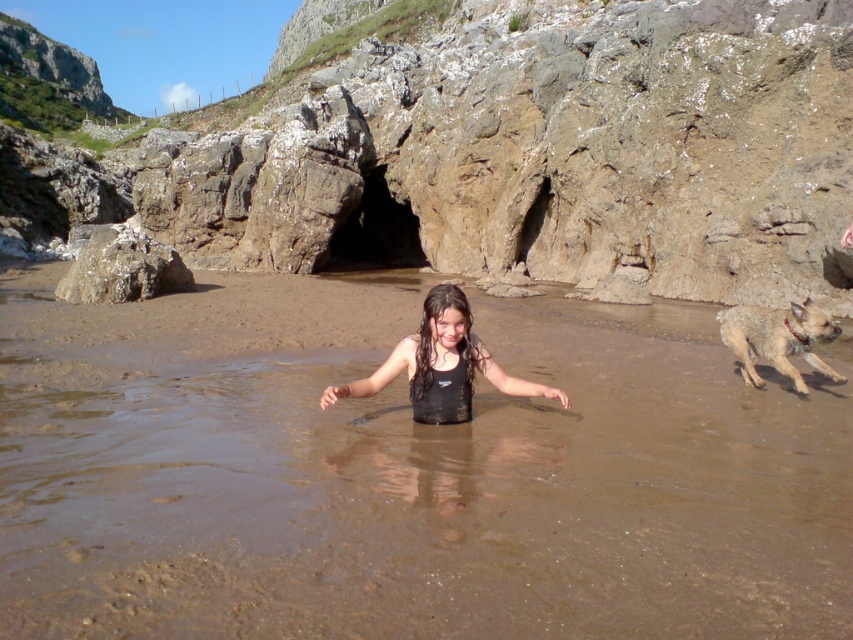
Question: Does smooth gray rock at center have a smaller size compared to brown furry dog at right?

Choices:
 (A) no
 (B) yes

Answer: (A)

Question: Is brown wet sand at center positioned before smooth gray rock at center?

Choices:
 (A) no
 (B) yes

Answer: (B)

Question: Is brown wet sand at center to the left of smooth gray rock at center from the viewer's perspective?

Choices:
 (A) yes
 (B) no

Answer: (B)

Question: Considering the real-world distances, which object is closest to the brown furry dog at right?

Choices:
 (A) brown wet sand at center
 (B) black matte swimsuit at center

Answer: (B)

Question: Which of the following is the farthest from the observer?

Choices:
 (A) smooth gray rock at center
 (B) black matte swimsuit at center
 (C) brown wet sand at center

Answer: (A)

Question: Among these points, which one is farthest from the camera?

Choices:
 (A) (741, 330)
 (B) (33, 499)
 (C) (424, 300)
 (D) (96, 230)

Answer: (D)